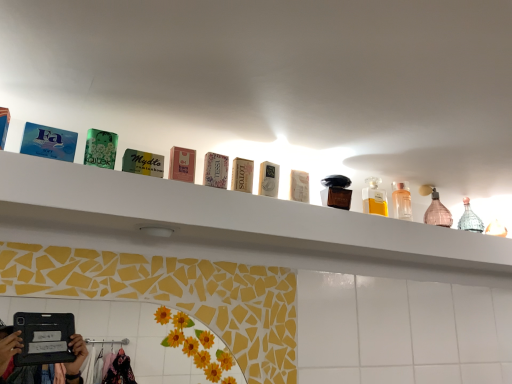
What do you see at coordinates (436, 209) in the screenshot? This screenshot has width=512, height=384. I see `pink glass bottle at upper right, which appears as the first mouthwash when viewed from the back` at bounding box center [436, 209].

Describe the element at coordinates (374, 198) in the screenshot. I see `translucent glass bottle at upper center, which ranks as the 1th mouthwash in left-to-right order` at that location.

How much space does clear glass bottle at upper right, the 1th toiletry in the right-to-left sequence, occupy vertically?

clear glass bottle at upper right, the 1th toiletry in the right-to-left sequence, is 4.63 inches in height.

At what (x,y) coordinates should I click in order to perform the action: click on shiny brown perfume at center, the 2th toiletry from the left. Please return your answer as a coordinate pair (x, y). Looking at the image, I should click on (336, 192).

Measure the distance between point (x=154, y=243) and camera.

The distance of point (x=154, y=243) from camera is 98.50 centimeters.

Find the location of a particular element. The image size is (512, 384). pink glass bottle at upper right, marked as the first mouthwash in a right-to-left arrangement is located at coordinates (436, 209).

Is shiny brown perfume at center, which is counted as the second toiletry, starting from the front, in front of or behind white glossy shelf at upper center in the image?

Visually, shiny brown perfume at center, which is counted as the second toiletry, starting from the front, is located behind white glossy shelf at upper center.

Which of these two, shiny brown perfume at center, the 2th toiletry from the left, or white glossy shelf at upper center, is smaller?

shiny brown perfume at center, the 2th toiletry from the left.

In the scene shown: From a real-world perspective, is shiny brown perfume at center, the second toiletry viewed from the back, below white glossy shelf at upper center?

Actually, shiny brown perfume at center, the second toiletry viewed from the back, is physically above white glossy shelf at upper center in the real world.

Which of these two, shiny brown perfume at center, the second toiletry viewed from the back, or white glossy shelf at upper center, is wider?

white glossy shelf at upper center.

From the image's perspective, is pink glass bottle at upper right, marked as the first mouthwash in a right-to-left arrangement, under shiny brown perfume at center, the second toiletry viewed from the back?

Yes, from the image's perspective, pink glass bottle at upper right, marked as the first mouthwash in a right-to-left arrangement, is below shiny brown perfume at center, the second toiletry viewed from the back.

Considering the positions of points (446, 212) and (337, 176), is point (446, 212) closer to camera compared to point (337, 176)?

No.

From a real-world perspective, is pink glass bottle at upper right, which appears as the second mouthwash when viewed from the left, above or below shiny brown perfume at center, which is counted as the 2th toiletry, starting from the right?

From a real-world perspective, pink glass bottle at upper right, which appears as the second mouthwash when viewed from the left, is physically above shiny brown perfume at center, which is counted as the 2th toiletry, starting from the right.

Considering the relative sizes of pink glass bottle at upper right, marked as the 2th mouthwash in a front-to-back arrangement, and shiny brown perfume at center, the second toiletry viewed from the back, in the image provided, is pink glass bottle at upper right, marked as the 2th mouthwash in a front-to-back arrangement, thinner than shiny brown perfume at center, the second toiletry viewed from the back,?

Yes.

Can you confirm if white glossy shelf at upper center is bigger than white cardboard box at center?

Yes.

Is white glossy shelf at upper center facing away from white cardboard box at center?

No, white glossy shelf at upper center's orientation is not away from white cardboard box at center.

From the image's perspective, which one is positioned lower, white glossy shelf at upper center or white cardboard box at center?

white glossy shelf at upper center.

Between white glossy shelf at upper center and white cardboard box at center, which one appears on the left side from the viewer's perspective?

white cardboard box at center.

Is clear glass bottle at upper right, positioned as the 1th toiletry in back-to-front order, to the left of shiny brown perfume at center, which is counted as the 2th toiletry, starting from the right, from the viewer's perspective?

In fact, clear glass bottle at upper right, positioned as the 1th toiletry in back-to-front order, is to the right of shiny brown perfume at center, which is counted as the 2th toiletry, starting from the right.

Is clear glass bottle at upper right, the 3th toiletry in the front-to-back sequence, outside of shiny brown perfume at center, the 2th toiletry from the left?

clear glass bottle at upper right, the 3th toiletry in the front-to-back sequence, lies outside shiny brown perfume at center, the 2th toiletry from the left,'s area.

Does clear glass bottle at upper right, positioned as the 1th toiletry in back-to-front order, have a lesser width compared to shiny brown perfume at center, which is counted as the 2th toiletry, starting from the right?

Indeed, clear glass bottle at upper right, positioned as the 1th toiletry in back-to-front order, has a lesser width compared to shiny brown perfume at center, which is counted as the 2th toiletry, starting from the right.

Identify the location of the 1st toiletry to the left of the clear glass bottle at upper right, positioned as the 1th toiletry in back-to-front order, counting from the anchor's position. The height and width of the screenshot is (384, 512). (336, 192).

Considering the sizes of matte pink soap at center, positioned as the 3th toiletry in back-to-front order, and pink glass bottle at upper right, marked as the first mouthwash in a right-to-left arrangement, in the image, is matte pink soap at center, positioned as the 3th toiletry in back-to-front order, bigger or smaller than pink glass bottle at upper right, marked as the first mouthwash in a right-to-left arrangement,?

A: Clearly, matte pink soap at center, positioned as the 3th toiletry in back-to-front order, is smaller in size than pink glass bottle at upper right, marked as the first mouthwash in a right-to-left arrangement.

Looking at this image, is matte pink soap at center, positioned as the 3th toiletry in back-to-front order, completely or partially outside of pink glass bottle at upper right, marked as the first mouthwash in a right-to-left arrangement?

matte pink soap at center, positioned as the 3th toiletry in back-to-front order, lies outside pink glass bottle at upper right, marked as the first mouthwash in a right-to-left arrangement,'s area.

Based on the photo, how distant is matte pink soap at center, which is counted as the third toiletry, starting from the right, from pink glass bottle at upper right, marked as the 2th mouthwash in a front-to-back arrangement?

matte pink soap at center, which is counted as the third toiletry, starting from the right, is 28.42 inches away from pink glass bottle at upper right, marked as the 2th mouthwash in a front-to-back arrangement.

From their relative heights in the image, would you say matte pink soap at center, which is counted as the third toiletry, starting from the right, is taller or shorter than pink glass bottle at upper right, which appears as the second mouthwash when viewed from the left?

matte pink soap at center, which is counted as the third toiletry, starting from the right, is shorter than pink glass bottle at upper right, which appears as the second mouthwash when viewed from the left.

From a real-world perspective, is matte pink soap at center, positioned as the 3th toiletry in back-to-front order, under translucent glass bottle at upper center, which ranks as the second mouthwash in back-to-front order?

Yes.

Could you measure the distance between matte pink soap at center, positioned as the 3th toiletry in back-to-front order, and translucent glass bottle at upper center, which ranks as the 1th mouthwash in left-to-right order?

The distance of matte pink soap at center, positioned as the 3th toiletry in back-to-front order, from translucent glass bottle at upper center, which ranks as the 1th mouthwash in left-to-right order, is 20.55 inches.

Would you say matte pink soap at center, which is counted as the third toiletry, starting from the right, contains translucent glass bottle at upper center, which ranks as the 1th mouthwash in left-to-right order?

That's incorrect, translucent glass bottle at upper center, which ranks as the 1th mouthwash in left-to-right order, is not inside matte pink soap at center, which is counted as the third toiletry, starting from the right.

Is matte pink soap at center, positioned as the 3th toiletry in back-to-front order, shorter than translucent glass bottle at upper center, positioned as the first mouthwash in front-to-back order?

Yes.

Is clear glass bottle at upper right, positioned as the 1th toiletry in back-to-front order, at the back of translucent glass bottle at upper center, which ranks as the second mouthwash in back-to-front order?

No, translucent glass bottle at upper center, which ranks as the second mouthwash in back-to-front order, is not facing away from clear glass bottle at upper right, positioned as the 1th toiletry in back-to-front order.

You are a GUI agent. You are given a task and a screenshot of the screen. Output one action in this format:
    pyautogui.click(x=<x>, y=<y>)
    Task: Click on the toiletry behind the translucent glass bottle at upper center, which ranks as the second mouthwash in back-to-front order
    The width and height of the screenshot is (512, 384).
    Given the screenshot: What is the action you would take?
    pyautogui.click(x=401, y=202)

Does translucent glass bottle at upper center, which ranks as the second mouthwash in back-to-front order, come behind clear glass bottle at upper right, the third toiletry in the left-to-right sequence?

No.

This screenshot has width=512, height=384. Find the location of `the 2nd toiletry above when counting from the white glossy shelf at upper center (from the image's perspective)`. the 2nd toiletry above when counting from the white glossy shelf at upper center (from the image's perspective) is located at coordinates (336, 192).

Identify the location of mouthwash that is the 2nd object to the right of the shiny brown perfume at center, which is counted as the second toiletry, starting from the front, starting at the anchor. This screenshot has height=384, width=512. (436, 209).

From the image, which object appears to be farther from matte pink soap at center, positioned as the 3th toiletry in back-to-front order, pink glass bottle at upper right, which appears as the first mouthwash when viewed from the back, or shiny brown perfume at center, which is counted as the second toiletry, starting from the front?

Based on the image, pink glass bottle at upper right, which appears as the first mouthwash when viewed from the back, appears to be further to matte pink soap at center, positioned as the 3th toiletry in back-to-front order.

Looking at the image, which one is located closer to matte pink soap at center, acting as the first toiletry starting from the front, clear glass bottle at upper right, positioned as the 1th toiletry in back-to-front order, or shiny brown perfume at center, the second toiletry viewed from the back?

Based on the image, shiny brown perfume at center, the second toiletry viewed from the back, appears to be nearer to matte pink soap at center, acting as the first toiletry starting from the front.

Estimate the real-world distances between objects in this image. Which object is further from white cardboard box at center, clear glass bottle at upper right, the third toiletry in the left-to-right sequence, or shiny brown perfume at center, which is counted as the second toiletry, starting from the front?

clear glass bottle at upper right, the third toiletry in the left-to-right sequence.

From the image, which object appears to be farther from matte pink soap at center, the first toiletry when ordered from left to right, white cardboard box at center or pink glass bottle at upper right, which appears as the first mouthwash when viewed from the back?

Among the two, pink glass bottle at upper right, which appears as the first mouthwash when viewed from the back, is located further to matte pink soap at center, the first toiletry when ordered from left to right.

Based on their spatial positions, is matte pink soap at center, the first toiletry when ordered from left to right, or pink glass bottle at upper right, which appears as the first mouthwash when viewed from the back, closer to translucent glass bottle at upper center, which ranks as the second mouthwash in back-to-front order?

pink glass bottle at upper right, which appears as the first mouthwash when viewed from the back.

Based on their spatial positions, is matte pink soap at center, positioned as the 3th toiletry in back-to-front order, or shiny brown perfume at center, which is counted as the 2th toiletry, starting from the right, further from white cardboard box at center?

shiny brown perfume at center, which is counted as the 2th toiletry, starting from the right.

Which object lies further to the anchor point translucent glass bottle at upper center, which ranks as the second mouthwash in back-to-front order, shiny brown perfume at center, the 2th toiletry from the left, or white cardboard box at center?

white cardboard box at center lies further to translucent glass bottle at upper center, which ranks as the second mouthwash in back-to-front order, than the other object.

Considering their positions, is translucent glass bottle at upper center, which ranks as the 1th mouthwash in left-to-right order, positioned closer to matte pink soap at center, acting as the first toiletry starting from the front, than white glossy shelf at upper center?

white glossy shelf at upper center is closer to matte pink soap at center, acting as the first toiletry starting from the front.

I want to click on shelf located between matte pink soap at center, acting as the first toiletry starting from the front, and pink glass bottle at upper right, which appears as the first mouthwash when viewed from the back, in the left-right direction, so click(x=223, y=224).

This screenshot has width=512, height=384. What are the coordinates of `product located between matte pink soap at center, acting as the first toiletry starting from the front, and pink glass bottle at upper right, marked as the first mouthwash in a right-to-left arrangement, in the left-right direction` in the screenshot? It's located at (269, 179).

Identify the location of mouthwash between white glossy shelf at upper center and clear glass bottle at upper right, the third toiletry in the left-to-right sequence, from front to back. The width and height of the screenshot is (512, 384). (374, 198).

Where is `product located between white glossy shelf at upper center and shiny brown perfume at center, which is counted as the second toiletry, starting from the front, in the depth direction`? product located between white glossy shelf at upper center and shiny brown perfume at center, which is counted as the second toiletry, starting from the front, in the depth direction is located at coordinates (269, 179).